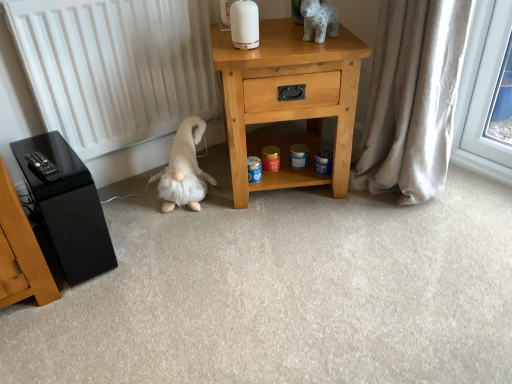
Image resolution: width=512 pixels, height=384 pixels. In order to click on vacant space in front of black glossy speaker at left in this screenshot , I will do `click(67, 311)`.